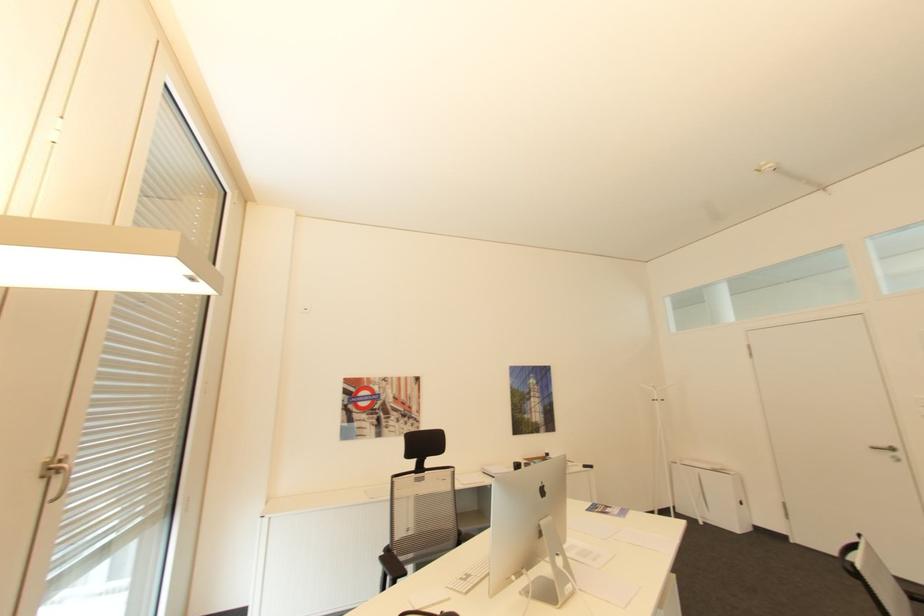
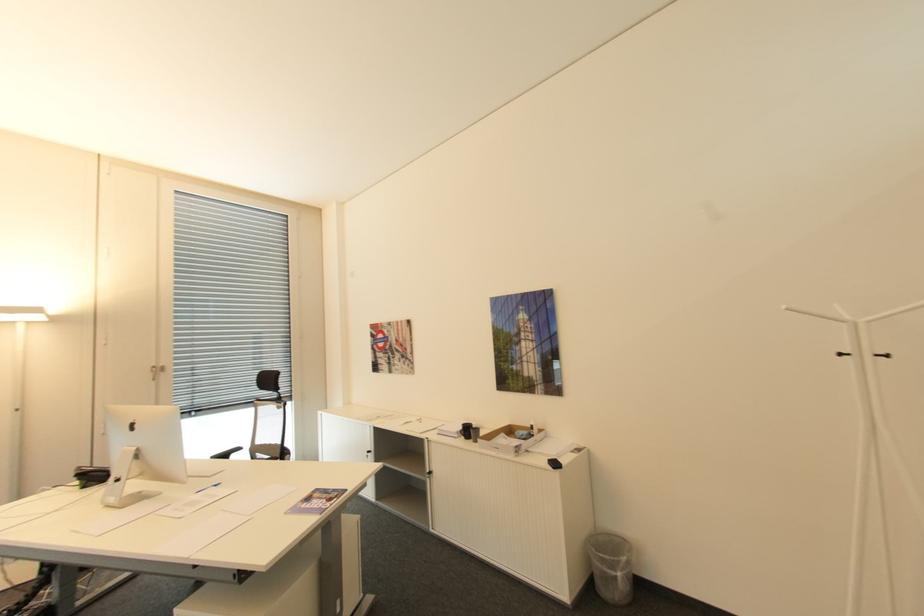
Find the pixel in the second image that matches pixel 657 384 in the first image.

(791, 307)